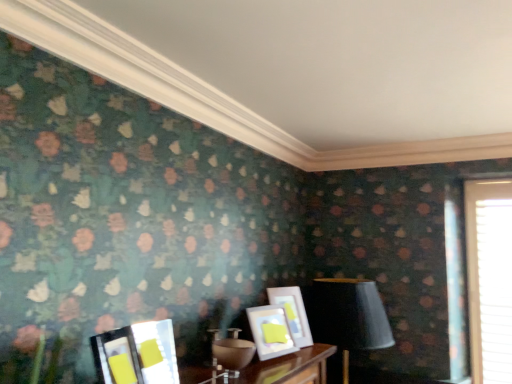
Question: Is matte glass picture frame at lower left, the 2th picture frame from the front, beside white textured blinds at right?

Choices:
 (A) yes
 (B) no

Answer: (B)

Question: From a real-world perspective, is matte glass picture frame at lower left, the 2th picture frame from the front, located higher than white textured blinds at right?

Choices:
 (A) yes
 (B) no

Answer: (B)

Question: Does matte glass picture frame at lower left, the 3th picture frame in the back-to-front sequence, have a greater width compared to white textured blinds at right?

Choices:
 (A) no
 (B) yes

Answer: (B)

Question: Is matte glass picture frame at lower left, the 2th picture frame from the front, positioned behind white textured blinds at right?

Choices:
 (A) no
 (B) yes

Answer: (A)

Question: Can you confirm if matte glass picture frame at lower left, the 2th picture frame from the front, is positioned to the right of white textured blinds at right?

Choices:
 (A) yes
 (B) no

Answer: (B)

Question: From a real-world perspective, is matte white picture frame at center, which ranks as the second picture frame in back-to-front order, physically located above or below matte black lampshade at center?

Choices:
 (A) above
 (B) below

Answer: (A)

Question: Considering the positions of matte white picture frame at center, which ranks as the second picture frame in back-to-front order, and matte black lampshade at center in the image, is matte white picture frame at center, which ranks as the second picture frame in back-to-front order, taller or shorter than matte black lampshade at center?

Choices:
 (A) short
 (B) tall

Answer: (A)

Question: Is matte white picture frame at center, positioned as the third picture frame in front-to-back order, wider or thinner than matte black lampshade at center?

Choices:
 (A) thin
 (B) wide

Answer: (A)

Question: Relative to matte black lampshade at center, is matte white picture frame at center, which ranks as the second picture frame in back-to-front order, in front or behind?

Choices:
 (A) behind
 (B) front

Answer: (B)

Question: Is white textured blinds at right inside the boundaries of matte black lampshade at center, or outside?

Choices:
 (A) inside
 (B) outside

Answer: (B)

Question: Considering the positions of point (501, 327) and point (335, 337), is point (501, 327) closer or farther from the camera than point (335, 337)?

Choices:
 (A) closer
 (B) farther

Answer: (B)

Question: Looking at the image, does white textured blinds at right seem bigger or smaller compared to matte black lampshade at center?

Choices:
 (A) small
 (B) big

Answer: (A)

Question: From a real-world perspective, is white textured blinds at right above or below matte black lampshade at center?

Choices:
 (A) above
 (B) below

Answer: (A)

Question: From a real-world perspective, is matte white picture frame at center, which ranks as the second picture frame in back-to-front order, positioned above or below matte glass picture frame at lower left, the 2th picture frame from the front?

Choices:
 (A) above
 (B) below

Answer: (A)

Question: Considering the positions of matte white picture frame at center, positioned as the third picture frame in front-to-back order, and matte glass picture frame at lower left, the 3th picture frame in the back-to-front sequence, in the image, is matte white picture frame at center, positioned as the third picture frame in front-to-back order, bigger or smaller than matte glass picture frame at lower left, the 3th picture frame in the back-to-front sequence,?

Choices:
 (A) small
 (B) big

Answer: (B)